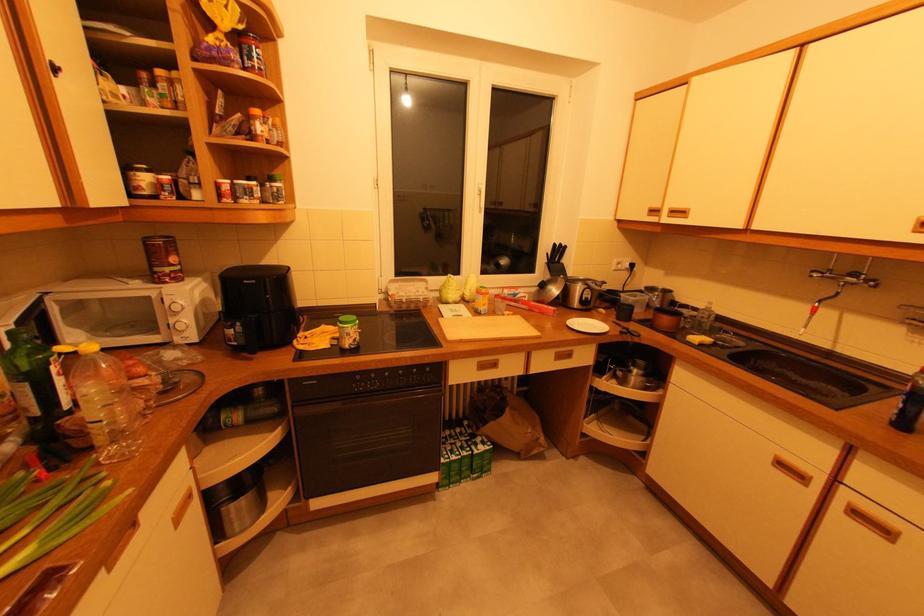
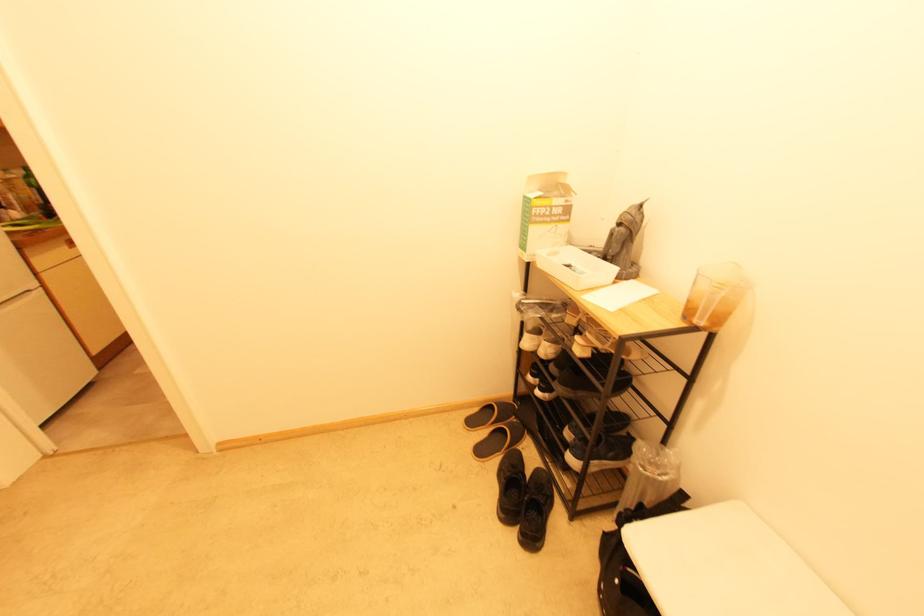
Question: I am providing you with two images of the same scene from different viewpoints. Please identify which objects are invisible in image2.

Choices:
 (A) pot lid handle
 (B) yellow door handle
 (C) white plastic tray
 (D) plastic liquid container

Answer: (A)